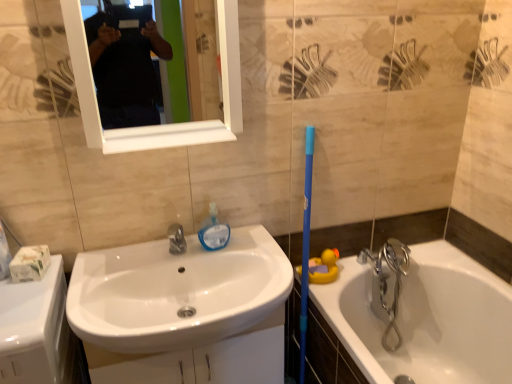
Where is `vacant space to the right of translucent plastic soap dispenser at center`? vacant space to the right of translucent plastic soap dispenser at center is located at coordinates point(258,248).